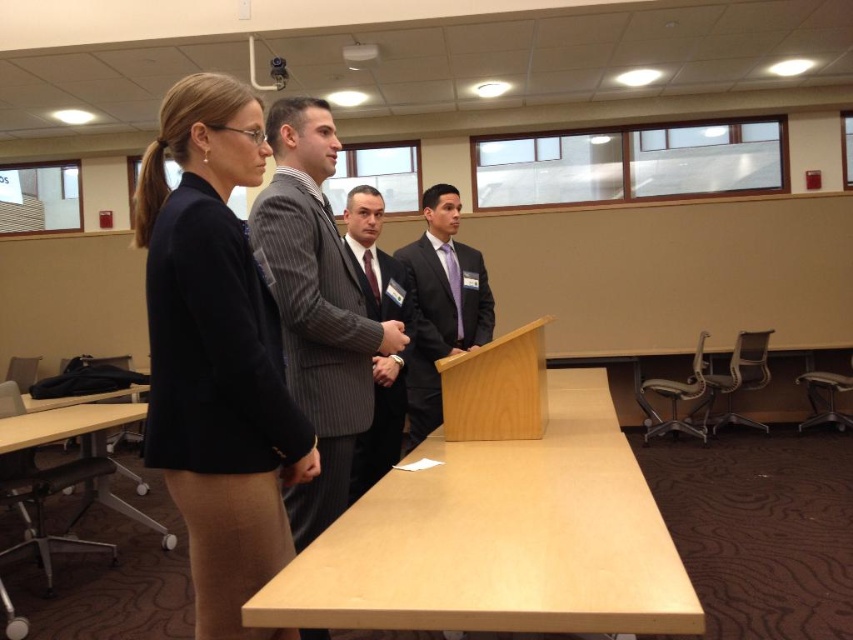
Question: Which of the following is the closest to the observer?

Choices:
 (A) (294, 256)
 (B) (202, 508)

Answer: (B)

Question: Which point is farther to the camera?

Choices:
 (A) light wood podium at center
 (B) dark blue blazer at left
 (C) dark gray pinstripe suit at center
 (D) pinstriped wool suit at center

Answer: (C)

Question: Which of the following is the farthest from the observer?

Choices:
 (A) dark blue blazer at left
 (B) pinstriped wool suit at center
 (C) light wood podium at center
 (D) striped wool suit at center

Answer: (B)

Question: Is dark blue blazer at left behind striped wool suit at center?

Choices:
 (A) no
 (B) yes

Answer: (A)

Question: Is dark blue blazer at left closer to the viewer compared to striped wool suit at center?

Choices:
 (A) no
 (B) yes

Answer: (B)

Question: Does dark gray pinstripe suit at center have a lesser width compared to pinstriped wool suit at center?

Choices:
 (A) no
 (B) yes

Answer: (A)